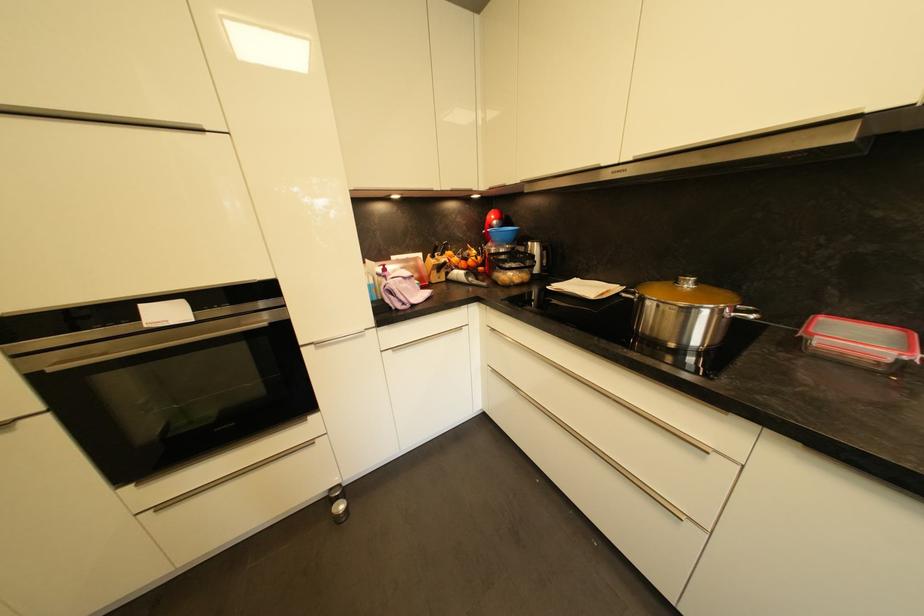
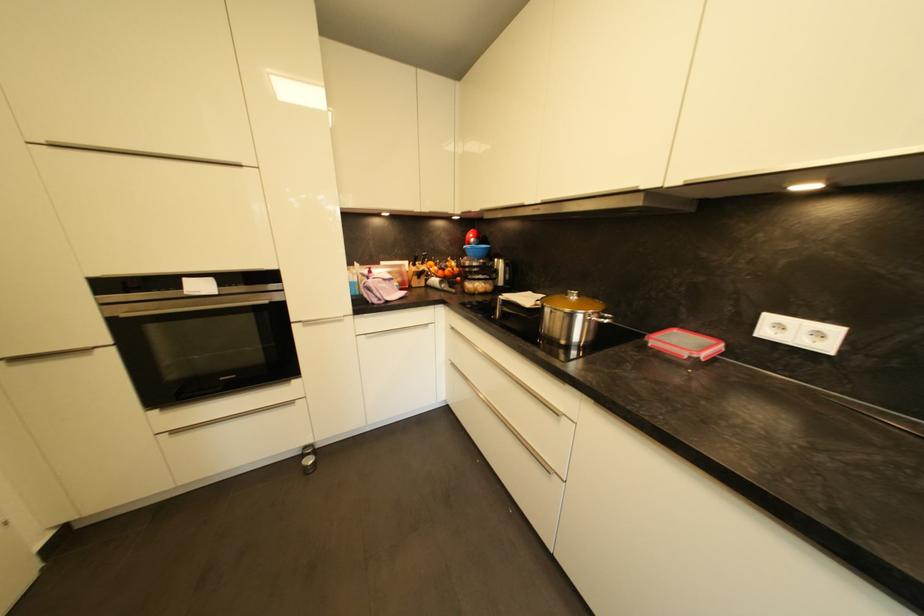
The point at (754, 314) is marked in the first image. Where is the corresponding point in the second image?

(610, 320)